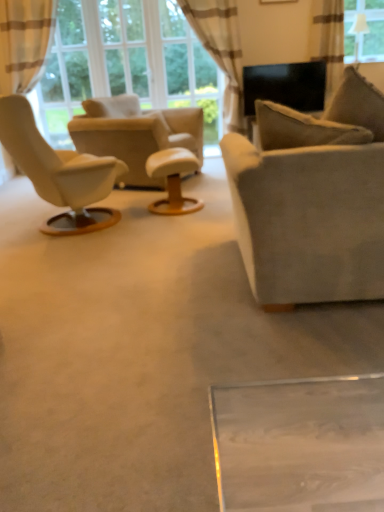
Question: Considering the positions of transparent glass window at upper right and beige striped curtain at upper center, which is counted as the 2th curtain, starting from the left, in the image, is transparent glass window at upper right wider or thinner than beige striped curtain at upper center, which is counted as the 2th curtain, starting from the left,?

Choices:
 (A) thin
 (B) wide

Answer: (A)

Question: Looking at the image, does transparent glass window at upper right seem bigger or smaller compared to beige striped curtain at upper center, which is counted as the 2th curtain, starting from the left?

Choices:
 (A) small
 (B) big

Answer: (A)

Question: Based on their relative distances, which object is nearer to the matte black picture frame at upper center?

Choices:
 (A) beige striped curtain at upper center, which is counted as the 2th curtain, starting from the right
 (B) satin beige curtain at upper right, positioned as the 3th curtain in left-to-right order
 (C) suede beige chair at center
 (D) white leather ottoman at center
 (E) transparent glass window at upper right

Answer: (B)

Question: Estimate the real-world distances between objects in this image. Which object is farther from the transparent glass window at upper right?

Choices:
 (A) beige fabric curtain at left, the 1th curtain positioned from the left
 (B) matte black picture frame at upper center
 (C) suede couch at center
 (D) suede beige chair at center
 (E) satin beige curtain at upper right, the first curtain in the right-to-left sequence

Answer: (A)